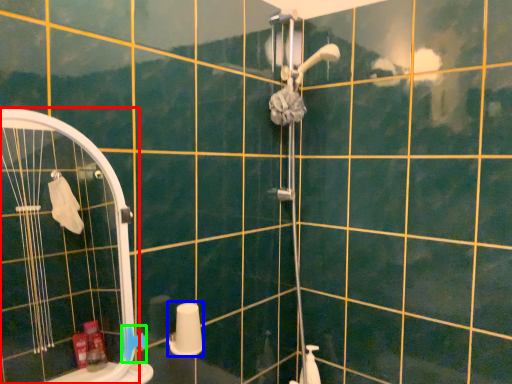
Question: Which object is positioned closest to screen door (highlighted by a red box)? Select from toilet paper (highlighted by a blue box) and towel bar (highlighted by a green box).

Choices:
 (A) toilet paper
 (B) towel bar

Answer: (A)